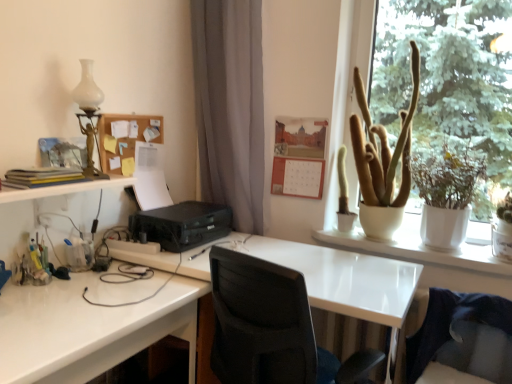
Question: Does white ceramic pot at upper right have a smaller size compared to matte yellow book at left?

Choices:
 (A) no
 (B) yes

Answer: (A)

Question: From a real-world perspective, is white ceramic pot at upper right under matte yellow book at left?

Choices:
 (A) yes
 (B) no

Answer: (B)

Question: Considering the relative sizes of white ceramic pot at upper right and matte yellow book at left in the image provided, is white ceramic pot at upper right thinner than matte yellow book at left?

Choices:
 (A) yes
 (B) no

Answer: (B)

Question: Is white ceramic pot at upper right far from matte yellow book at left?

Choices:
 (A) yes
 (B) no

Answer: (A)

Question: From the image's perspective, does white ceramic pot at upper right appear lower than matte yellow book at left?

Choices:
 (A) no
 (B) yes

Answer: (A)

Question: From a real-world perspective, does white ceramic pot at upper right stand above matte yellow book at left?

Choices:
 (A) yes
 (B) no

Answer: (A)

Question: Does white glossy desk at lower left, the second desk in the right-to-left sequence, lie in front of white glossy desk at center, placed as the first desk when sorted from right to left?

Choices:
 (A) no
 (B) yes

Answer: (B)

Question: From a real-world perspective, is white glossy desk at lower left, the second desk in the right-to-left sequence, positioned over white glossy desk at center, positioned as the second desk in left-to-right order, based on gravity?

Choices:
 (A) no
 (B) yes

Answer: (B)

Question: Considering the relative sizes of white glossy desk at lower left, the second desk in the right-to-left sequence, and white glossy desk at center, placed as the first desk when sorted from right to left, in the image provided, is white glossy desk at lower left, the second desk in the right-to-left sequence, smaller than white glossy desk at center, placed as the first desk when sorted from right to left,?

Choices:
 (A) yes
 (B) no

Answer: (A)

Question: Is white glossy desk at lower left, which is the first desk from left to right, wider than white glossy desk at center, positioned as the second desk in left-to-right order?

Choices:
 (A) yes
 (B) no

Answer: (B)

Question: From the image's perspective, does white glossy desk at lower left, the second desk in the right-to-left sequence, appear higher than white glossy desk at center, placed as the first desk when sorted from right to left?

Choices:
 (A) no
 (B) yes

Answer: (B)

Question: From the image's perspective, is white glossy desk at lower left, the second desk in the right-to-left sequence, beneath white glossy desk at center, placed as the first desk when sorted from right to left?

Choices:
 (A) yes
 (B) no

Answer: (B)

Question: Does white ceramic pot at upper right have a lesser height compared to white glossy desk at lower left, which is the first desk from left to right?

Choices:
 (A) yes
 (B) no

Answer: (B)